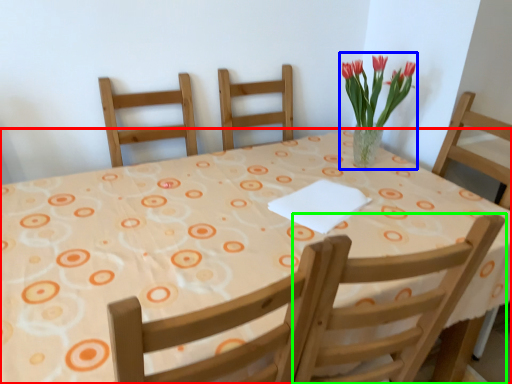
Question: Considering the real-world distances, which object is farthest from table (highlighted by a red box)? floral arrangement (highlighted by a blue box) or chair (highlighted by a green box)?

Choices:
 (A) floral arrangement
 (B) chair

Answer: (A)